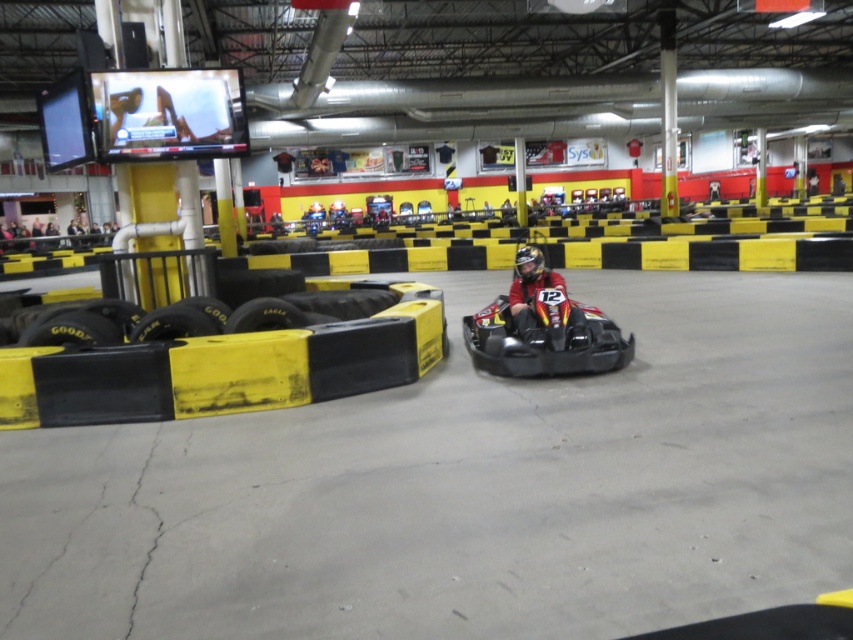
You are standing at the entrance of the go kart facility and want to reach the point marked as point (61, 333). The facility has a rule that you must stay at least 6 meters away from any go karts. Can you safely walk to that point without violating the rule?

The distance of point (61, 333) from viewer is 5.89 meters. Since the required distance is 6 meters, you are 0.11 meters too close, so you cannot safely walk to that point without violating the rule.

You are a maintenance worker in the go kart facility. You need to retrieve the yellow rubber tire at left. The facility has a rule that you can only move within 5 meters of the camera. Can you reach the tire without violating the rule?

The yellow rubber tire at left is 5.87 meters from the camera, which is beyond the 5 meter limit. Therefore, you cannot retrieve it without breaking the rule.